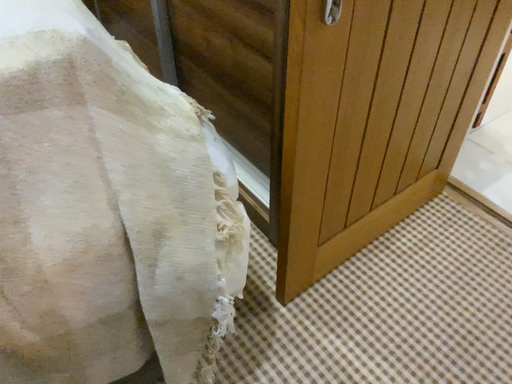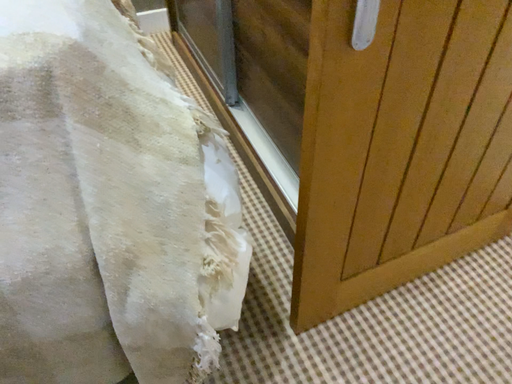
Question: How did the camera likely rotate when shooting the video?

Choices:
 (A) rotated left
 (B) rotated right

Answer: (A)